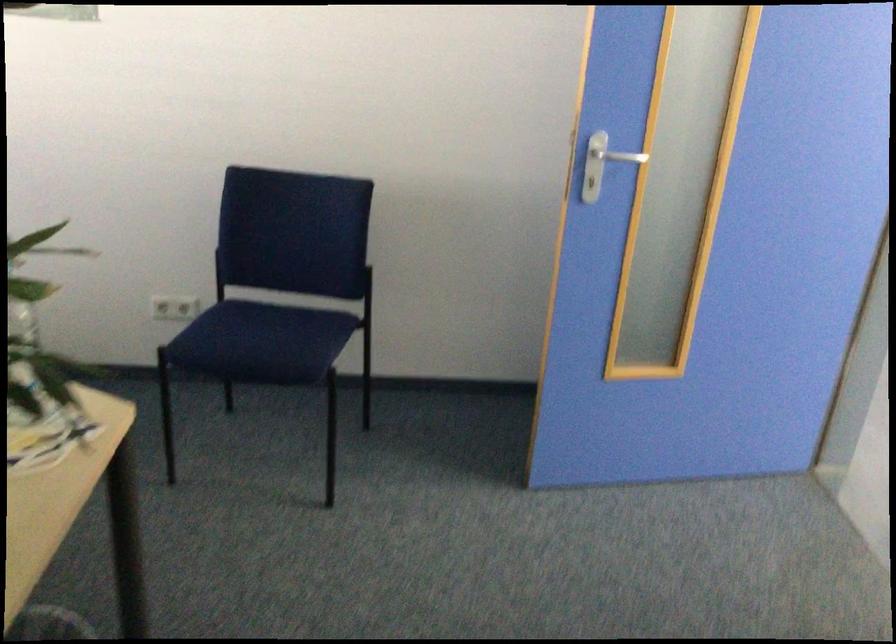
Find the location of a particular element. blue chair sitting surface is located at coordinates (271, 328).